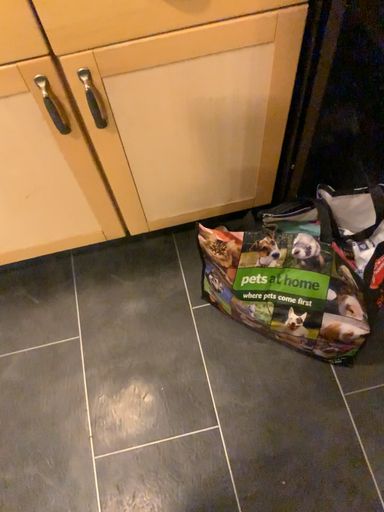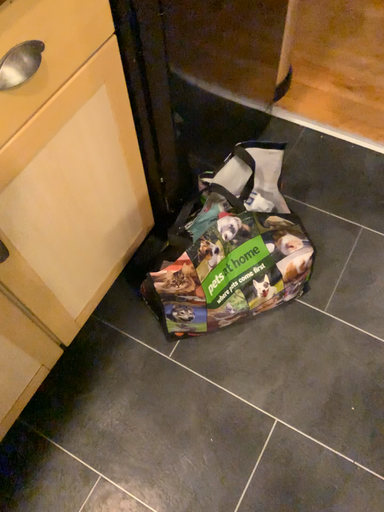
Question: Which way did the camera rotate in the video?

Choices:
 (A) rotated left
 (B) rotated right

Answer: (B)